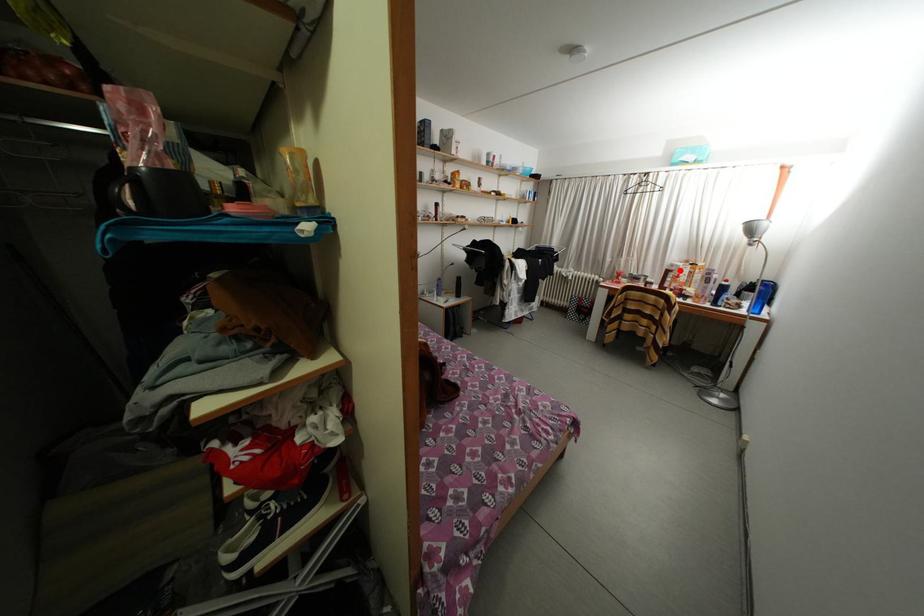
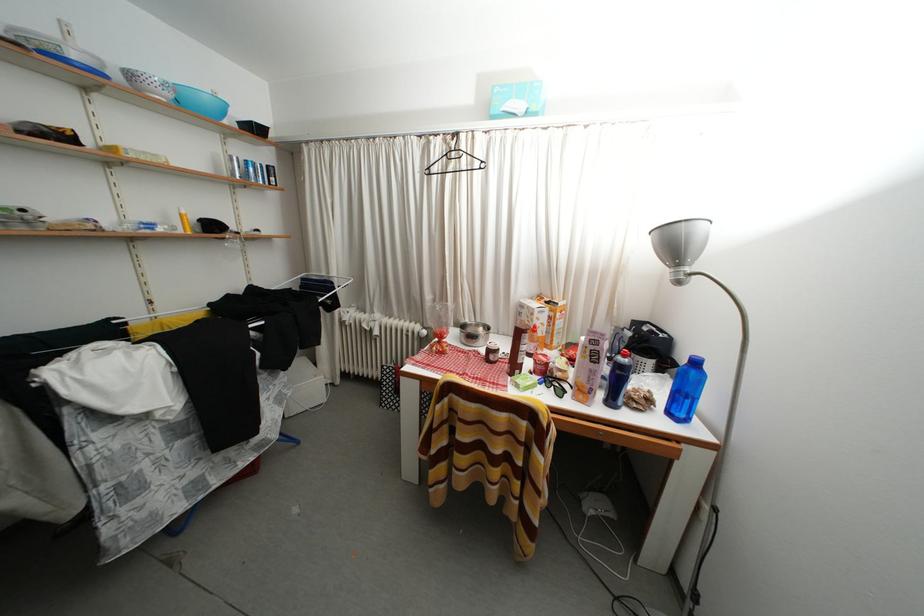
The point at the highlighted location is marked in the first image. Where is the corresponding point in the second image?

(529, 310)